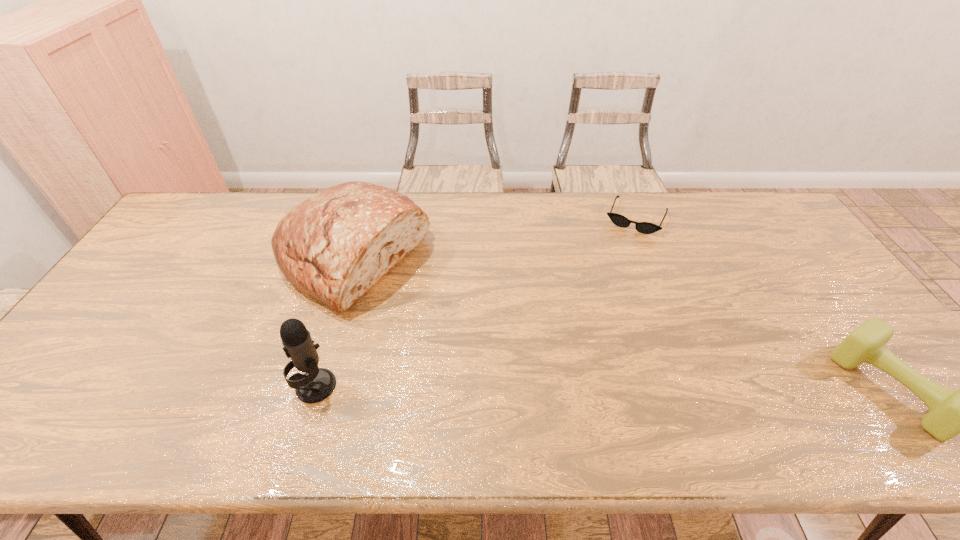
Locate an element on the screen. The width and height of the screenshot is (960, 540). vacant space on the desktop that is between the microphone and the dumbbell and is positioned at the sliced front of the bread is located at coordinates (567, 387).

Image resolution: width=960 pixels, height=540 pixels. What are the coordinates of `vacant space on the desktop that is between the microphone and the dumbbell and is positioned on the front-facing side of the second object from right to left` in the screenshot? It's located at (564, 387).